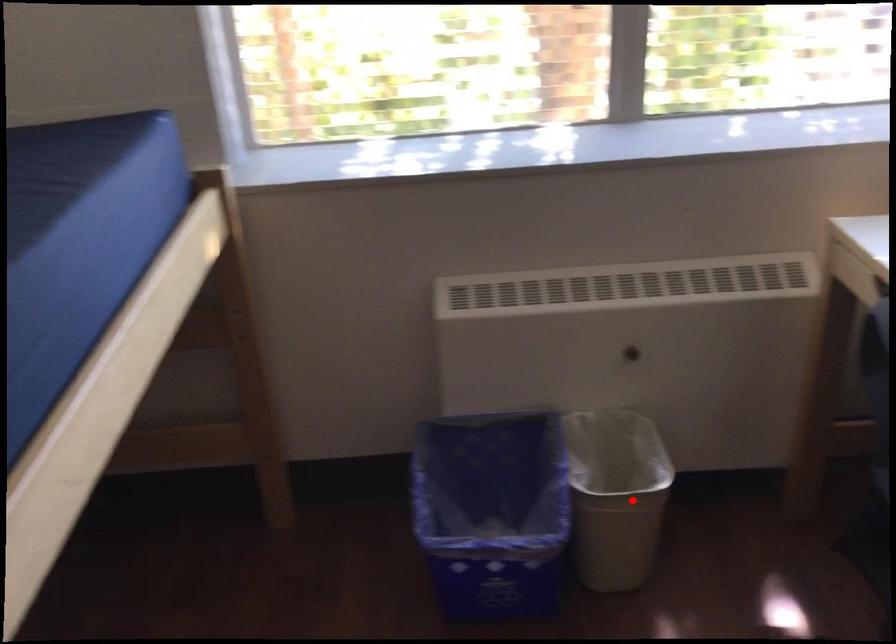
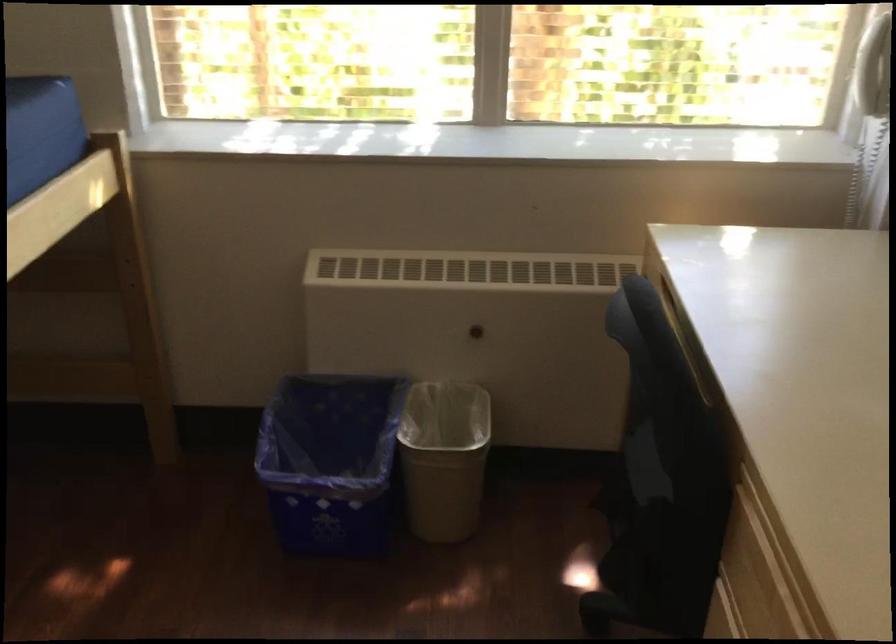
Question: A red point is marked in image1. In image2, is the corresponding 3D point closer to the camera or farther? Reply with the corresponding letter.

Choices:
 (A) The corresponding 3D point is closer.
 (B) The corresponding 3D point is farther.

Answer: (B)